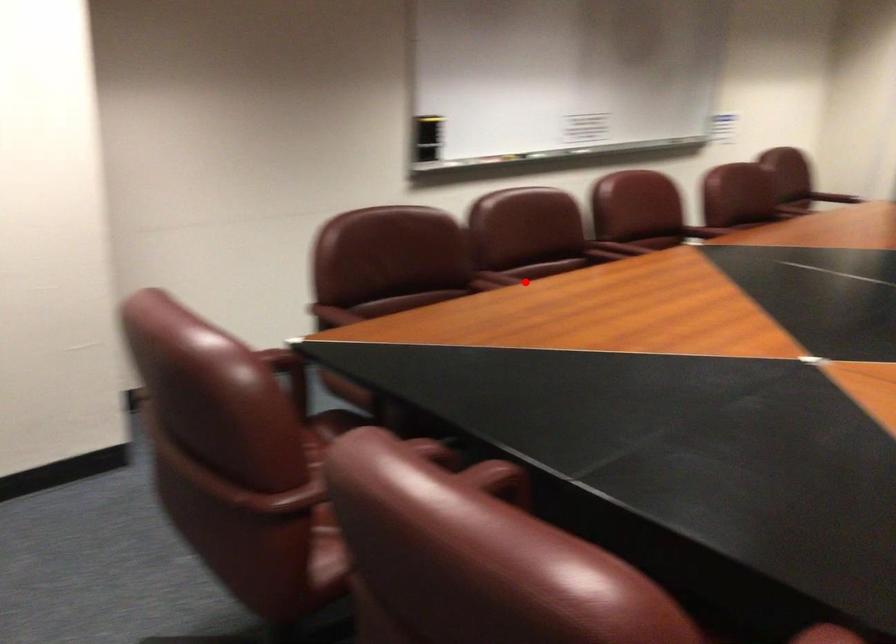
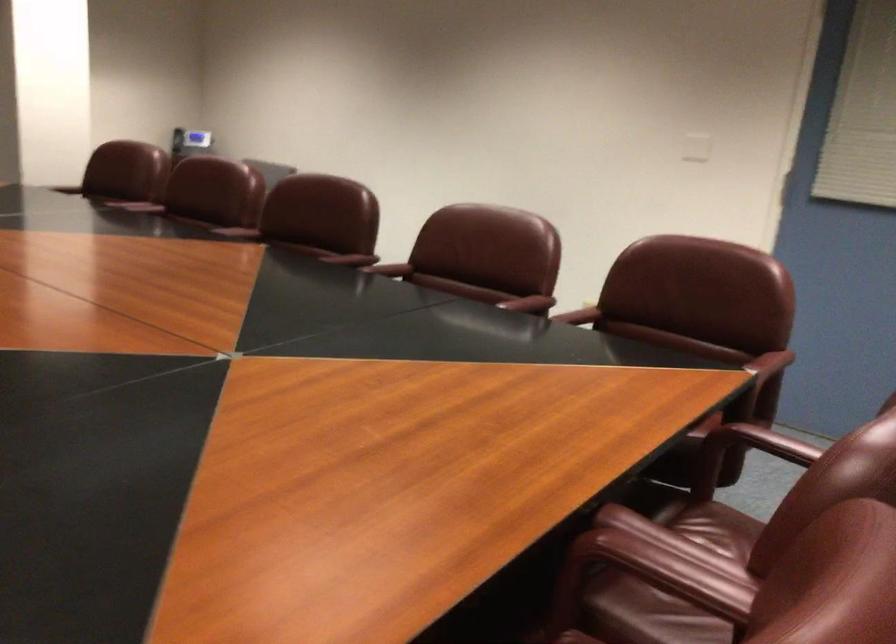
The point at the highlighted location is marked in the first image. Where is the corresponding point in the second image?

(657, 573)